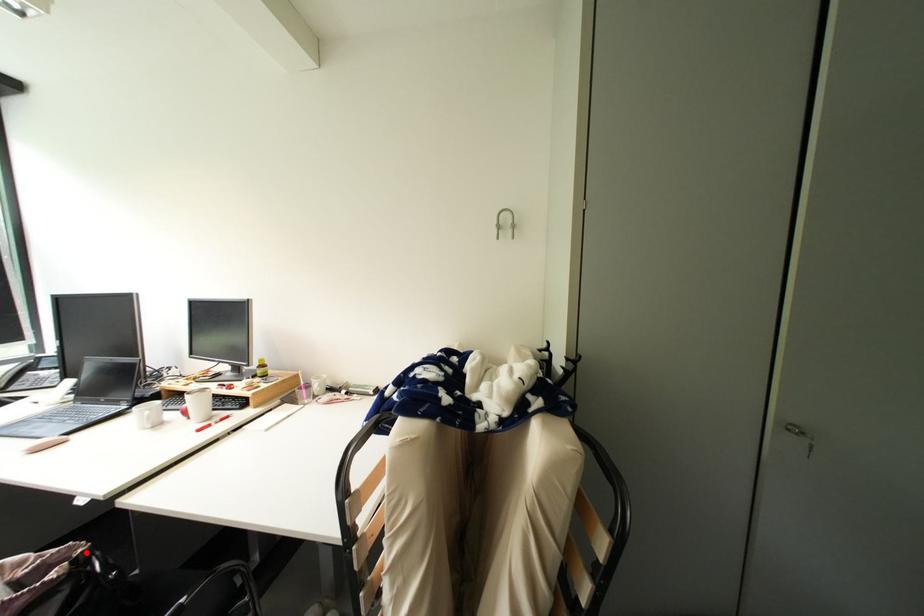
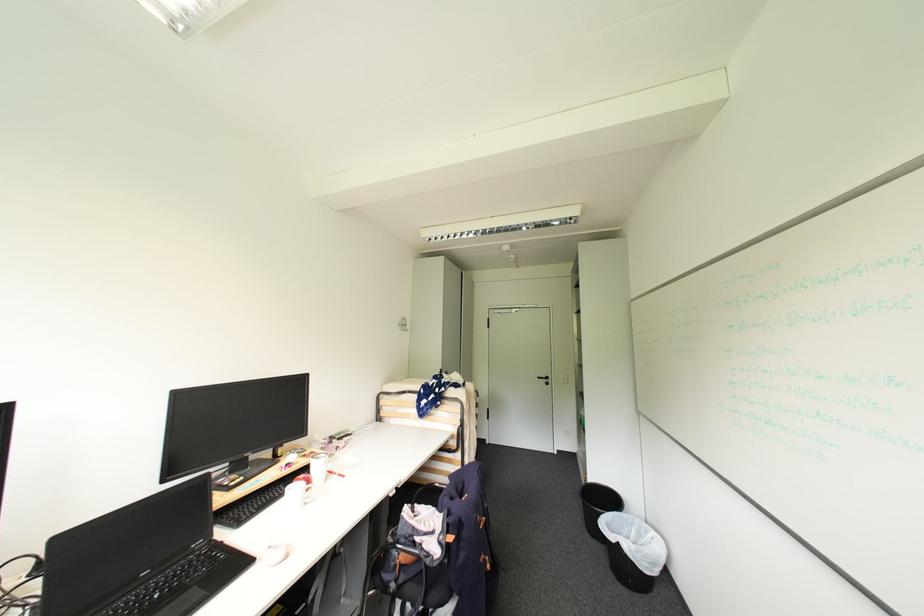
The point at the highlighted location is marked in the first image. Where is the corresponding point in the second image?

(417, 506)